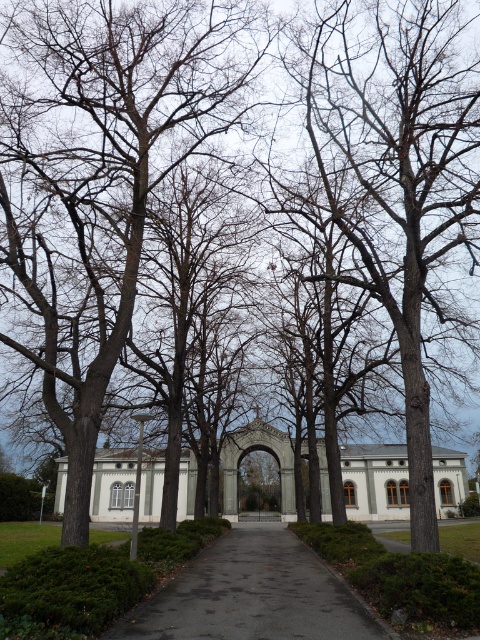
You are standing at the grand archway entrance and want to place a small decorative statue exactly halfway between point (338, 120) and point (308, 637). Which point will the statue be closer to?

The statue will be closer to point (308, 637) because point (338, 120) is behind it, making the midpoint closer to the latter point.

You are standing at the entrance of the grand archway and looking towards the center of the image. Which direction should you walk to reach the point marked by the coordinates point (398, 177)?

The point (398, 177) is located at the center of the image, so you should walk straight ahead from the entrance of the grand archway to reach it.

You are a landscape architect designing a new park and want to ensure visitors can see the archway from the entrance. Given the bare wood tree at center and the dark asphalt path at center, which object might obstruct the view of the archway if not managed properly?

The bare wood tree at center is much taller than the dark asphalt path at center, so the tree could potentially obstruct the view of the archway if not pruned or positioned carefully.